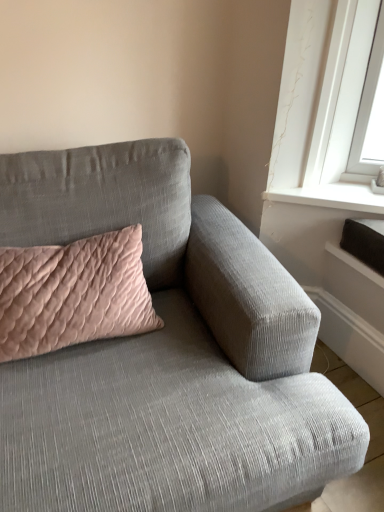
Question: Based on their positions, is textured gray couch at center located to the left or right of pink quilted cushion at upper left?

Choices:
 (A) right
 (B) left

Answer: (A)

Question: Looking at their shapes, would you say textured gray couch at center is wider or thinner than pink quilted cushion at upper left?

Choices:
 (A) thin
 (B) wide

Answer: (B)

Question: Is textured gray couch at center taller or shorter than pink quilted cushion at upper left?

Choices:
 (A) tall
 (B) short

Answer: (A)

Question: Considering the positions of pink quilted cushion at upper left and textured gray couch at center in the image, is pink quilted cushion at upper left bigger or smaller than textured gray couch at center?

Choices:
 (A) small
 (B) big

Answer: (A)

Question: Considering the positions of point (41, 336) and point (266, 420), is point (41, 336) closer or farther from the camera than point (266, 420)?

Choices:
 (A) farther
 (B) closer

Answer: (A)

Question: From the image's perspective, is pink quilted cushion at upper left located above or below textured gray couch at center?

Choices:
 (A) above
 (B) below

Answer: (A)

Question: From a real-world perspective, relative to textured gray couch at center, is pink quilted cushion at upper left vertically above or below?

Choices:
 (A) below
 (B) above

Answer: (B)